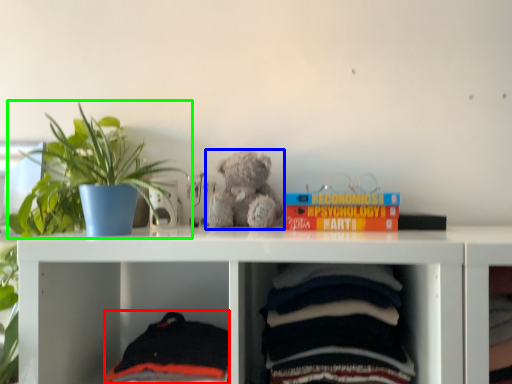
Question: Which object is the closest to the baby clothe (highlighted by a red box)? Choose among these: teddy bear (highlighted by a blue box) or houseplant (highlighted by a green box).

Choices:
 (A) teddy bear
 (B) houseplant

Answer: (A)